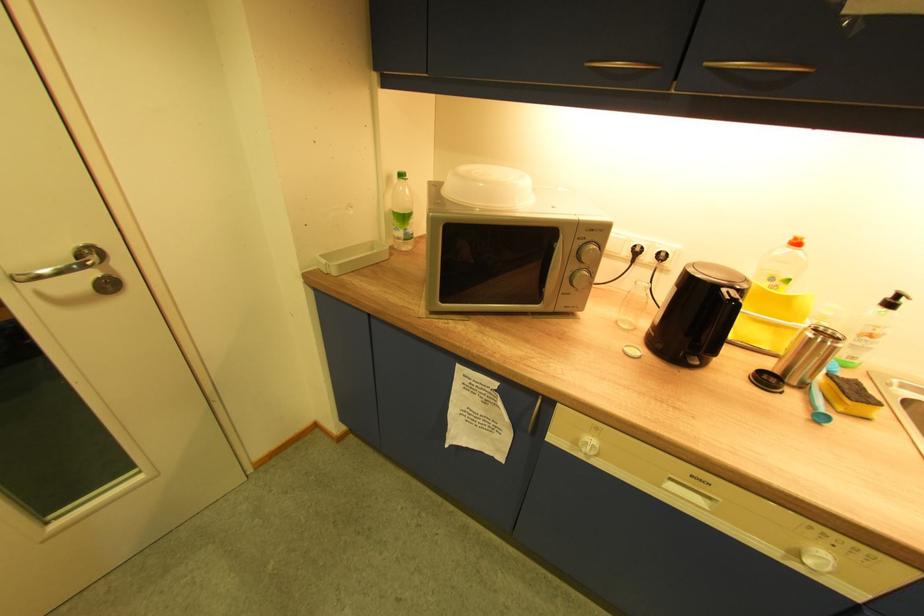
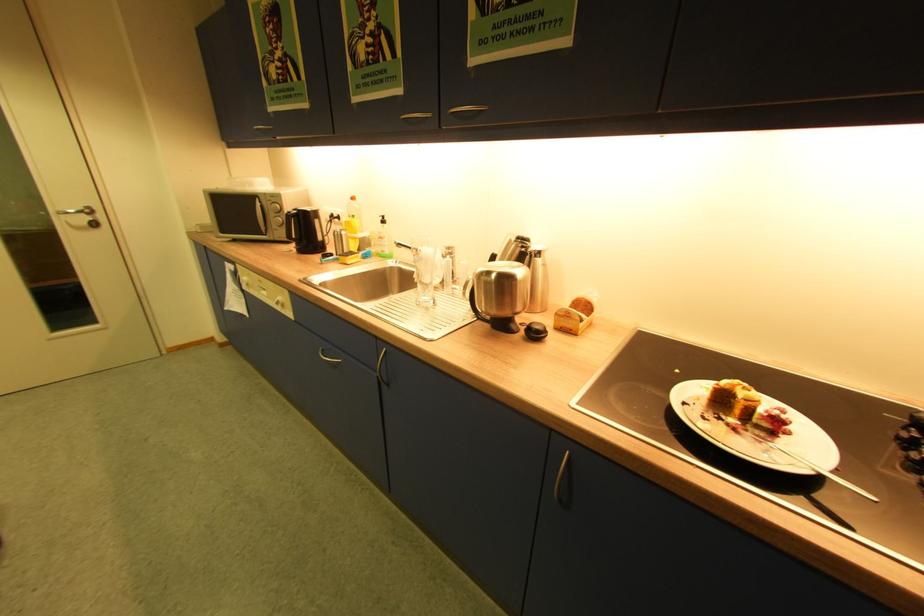
Find the pixel in the second image that matches (734,299) in the first image.

(296, 214)